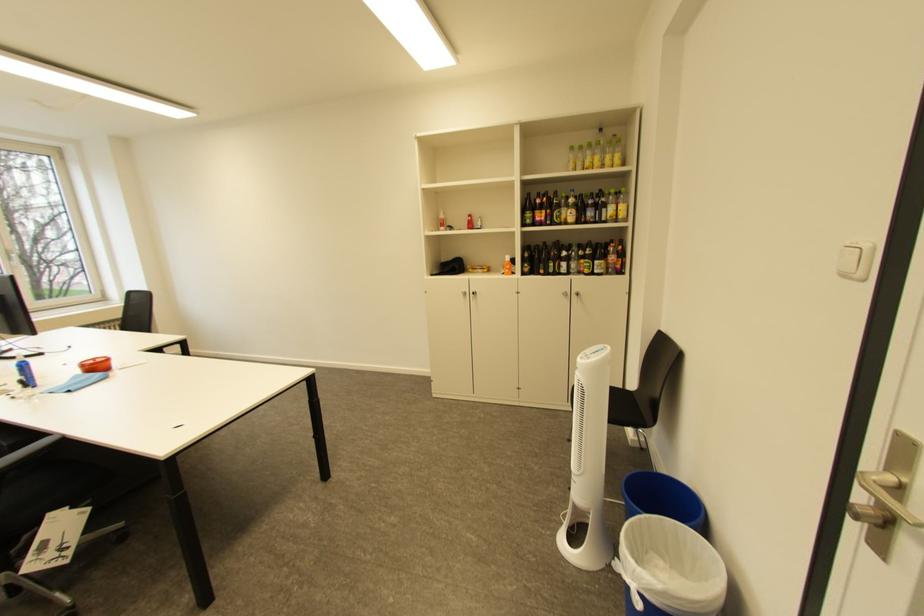
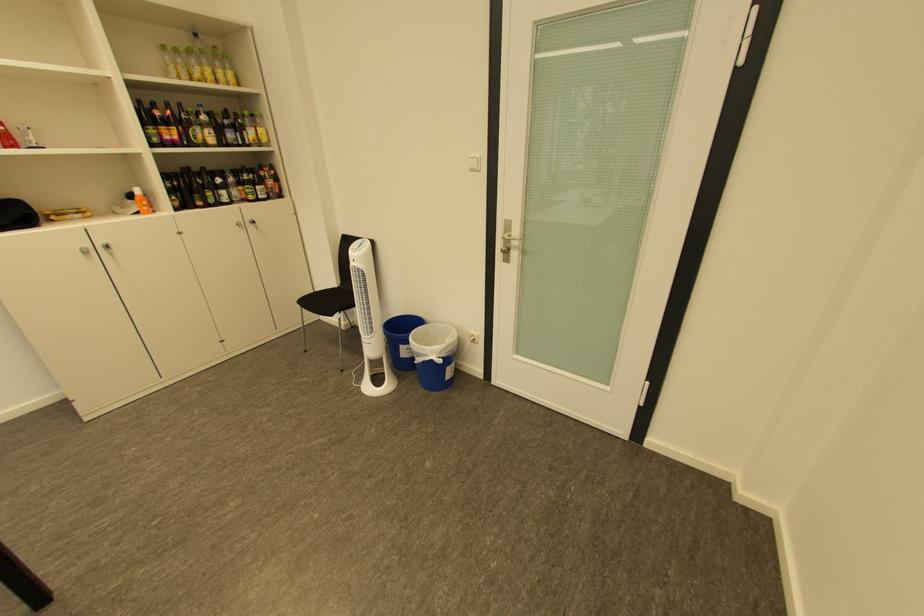
Find the pixel in the second image that matches the point at 617,159 in the first image.

(228, 73)